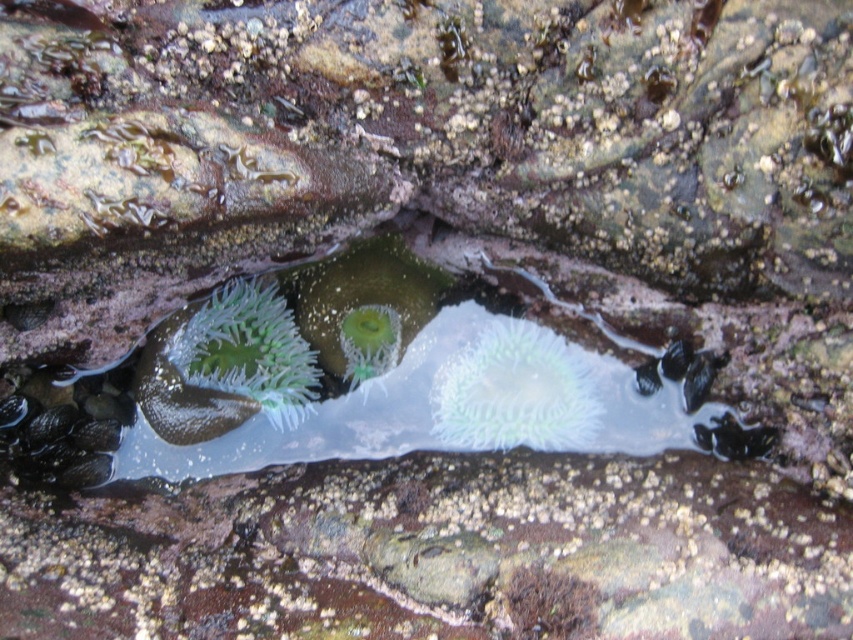
Is translucent gelatinous anemone at center below green translucent anemone at center?

Yes, translucent gelatinous anemone at center is below green translucent anemone at center.

Who is positioned more to the left, translucent gelatinous anemone at center or green translucent anemone at center?

From the viewer's perspective, green translucent anemone at center appears more on the left side.

Between point (445, 392) and point (258, 305), which one is positioned in front?

Point (258, 305) is more forward.

In order to click on translucent gelatinous anemone at center in this screenshot , I will do `click(515, 392)`.